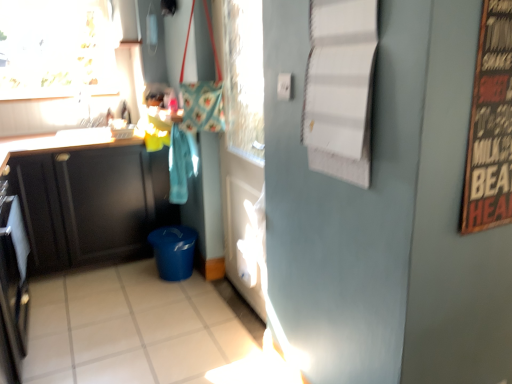
You are a GUI agent. You are given a task and a screenshot of the screen. Output one action in this format:
    pyautogui.click(x=<x>, y=<y>)
    Task: Click on the free space to the back side of black stainless steel oven at left
    The image size is (512, 384).
    Given the screenshot: What is the action you would take?
    pyautogui.click(x=70, y=298)